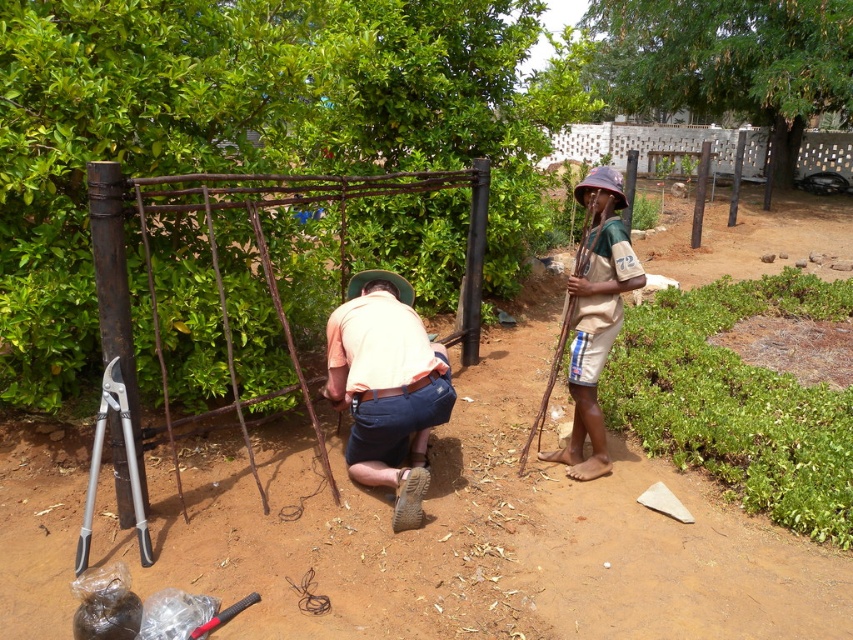
Question: Which object is closer to the camera taking this photo?

Choices:
 (A) light orange cotton shirt at center
 (B) brown dirt field at center

Answer: (B)

Question: Where is brown dirt field at center located in relation to light orange cotton shirt at center in the image?

Choices:
 (A) right
 (B) left

Answer: (B)

Question: Which object appears closest to the camera in this image?

Choices:
 (A) brown fabric hat at right
 (B) light orange cotton shirt at center
 (C) white brick fence at upper center
 (D) brown dirt field at center

Answer: (D)

Question: Is brown fabric hat at right positioned at the back of white brick fence at upper center?

Choices:
 (A) yes
 (B) no

Answer: (B)

Question: Can you confirm if light orange cotton shirt at center is smaller than brown fabric hat at right?

Choices:
 (A) yes
 (B) no

Answer: (A)

Question: Which point appears closest to the camera in this image?

Choices:
 (A) (817, 172)
 (B) (525, 524)
 (C) (601, 291)
 (D) (415, 433)

Answer: (B)